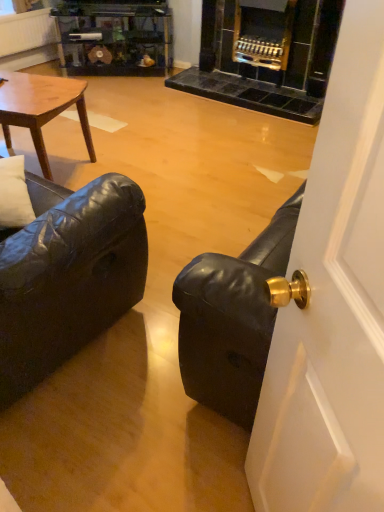
Question: Is wooden glossy coffee table at upper left surrounding black leather couch at left?

Choices:
 (A) no
 (B) yes

Answer: (A)

Question: Is wooden glossy coffee table at upper left to the left of black leather couch at left from the viewer's perspective?

Choices:
 (A) no
 (B) yes

Answer: (B)

Question: Can you confirm if wooden glossy coffee table at upper left is positioned to the right of black leather couch at left?

Choices:
 (A) yes
 (B) no

Answer: (B)

Question: From a real-world perspective, does wooden glossy coffee table at upper left sit lower than black leather couch at left?

Choices:
 (A) no
 (B) yes

Answer: (B)

Question: Considering the relative sizes of wooden glossy coffee table at upper left and black leather couch at left in the image provided, is wooden glossy coffee table at upper left smaller than black leather couch at left?

Choices:
 (A) no
 (B) yes

Answer: (B)

Question: From a real-world perspective, is wooden glossy coffee table at upper left positioned above or below black leather couch at right?

Choices:
 (A) above
 (B) below

Answer: (B)

Question: From the image's perspective, is wooden glossy coffee table at upper left above or below black leather couch at right?

Choices:
 (A) below
 (B) above

Answer: (B)

Question: In terms of width, does wooden glossy coffee table at upper left look wider or thinner when compared to black leather couch at right?

Choices:
 (A) thin
 (B) wide

Answer: (A)

Question: Is point (34, 133) positioned closer to the camera than point (264, 384)?

Choices:
 (A) farther
 (B) closer

Answer: (A)

Question: From the image's perspective, is black leather couch at right positioned above or below black leather couch at left?

Choices:
 (A) below
 (B) above

Answer: (A)

Question: Is black leather couch at right wider or thinner than black leather couch at left?

Choices:
 (A) thin
 (B) wide

Answer: (A)

Question: In the image, is black leather couch at right positioned in front of or behind black leather couch at left?

Choices:
 (A) front
 (B) behind

Answer: (A)

Question: Would you say black leather couch at right is to the left or to the right of black leather couch at left in the picture?

Choices:
 (A) left
 (B) right

Answer: (B)

Question: From a real-world perspective, is black leather couch at left positioned above or below black leather couch at right?

Choices:
 (A) below
 (B) above

Answer: (A)

Question: From their relative heights in the image, would you say black leather couch at left is taller or shorter than black leather couch at right?

Choices:
 (A) tall
 (B) short

Answer: (B)